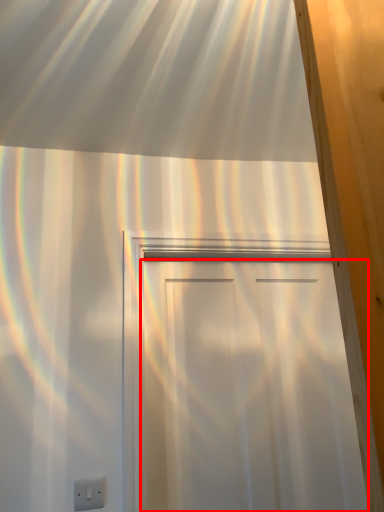
Question: In this image, where is door (annotated by the red box) located relative to electric outlet?

Choices:
 (A) left
 (B) right

Answer: (B)